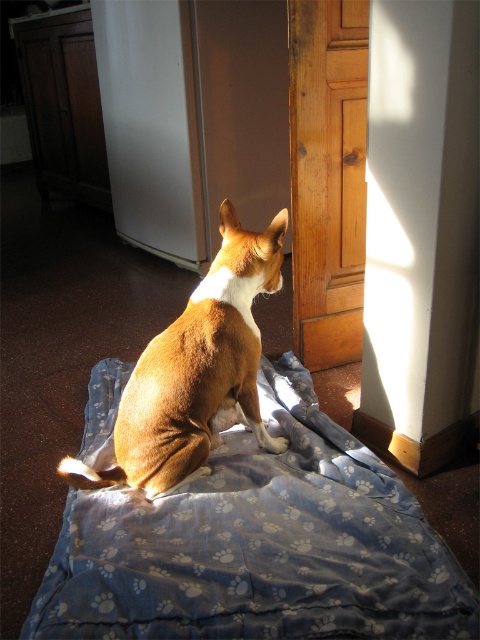
You are a small robot with a width of 10 inches. You need to move from the blue fabric sheet at center to the brown furry dog at center. Can you pass through the space between them without touching either?

The distance between the blue fabric sheet at center and the brown furry dog at center is 10.98 inches. Since the robot is 10 inches wide, there is enough space for it to pass through without touching either object.

Based on the photo, you need to place a new small toy for the brown furry dog at center. The toy requires a space larger than the dog itself. Is the blue fabric sheet at center a suitable spot?

The blue fabric sheet at center is bigger than the brown furry dog at center, so it can accommodate the toy requiring space larger than the dog.